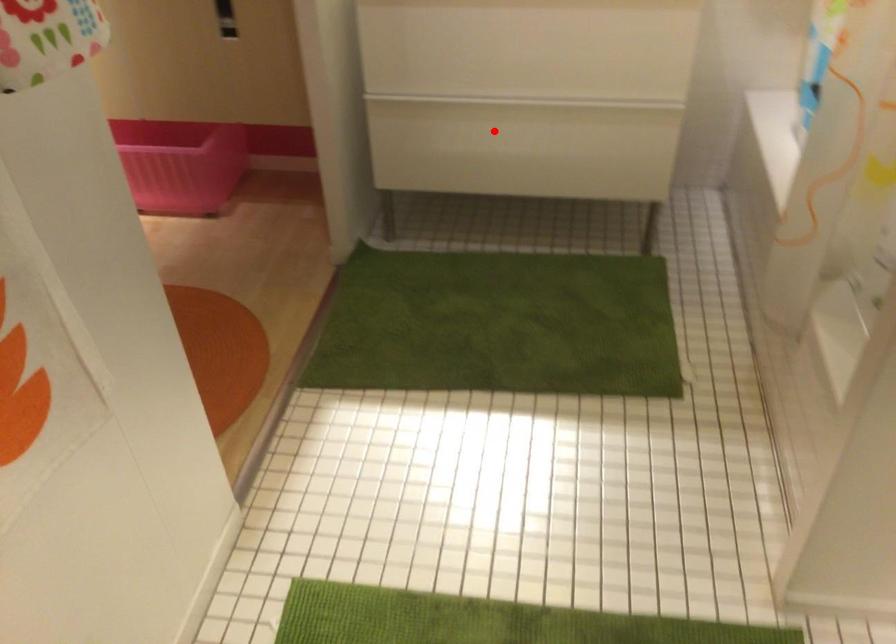
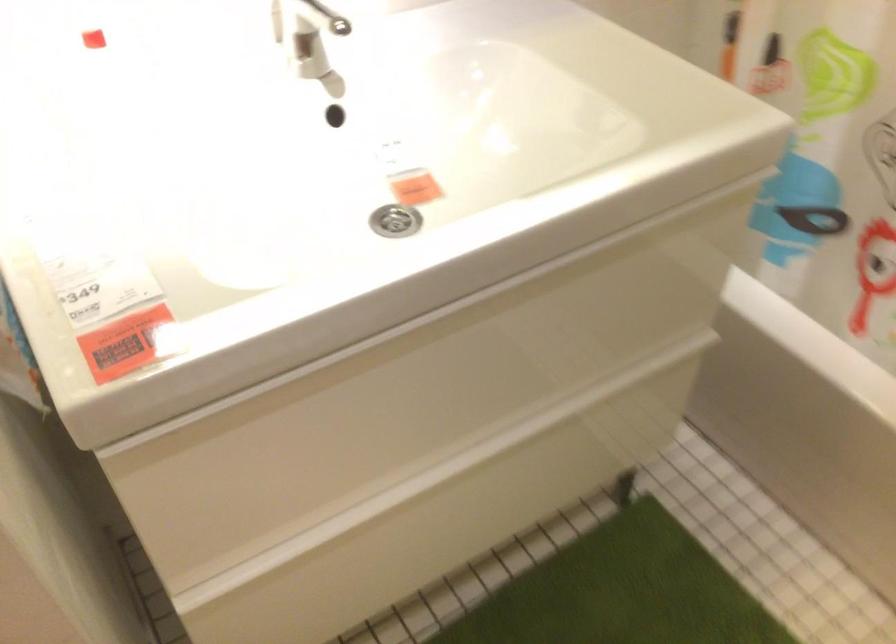
Question: I am providing you with two images of the same scene from different viewpoints. Image1 has a red point marked. In image2, the corresponding 3D location appears at what relative position? Reply with the corresponding letter.

Choices:
 (A) Closer
 (B) Farther

Answer: (A)